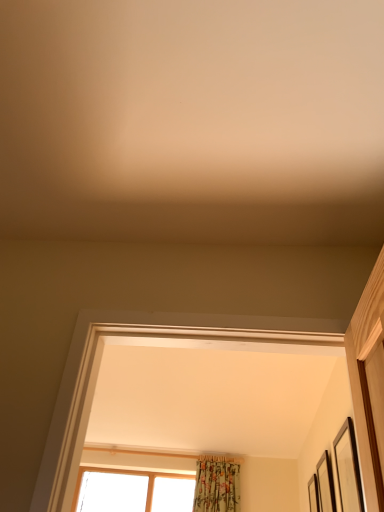
Question: In terms of width, does wooden picture frame at right, placed as the 2th picture frame when sorted from left to right, look wider or thinner when compared to black matte picture frame at right, which appears as the first picture frame when viewed from the top?

Choices:
 (A) thin
 (B) wide

Answer: (B)

Question: Is wooden picture frame at right, the second picture frame positioned from the bottom, situated inside black matte picture frame at right, which appears as the first picture frame when viewed from the top, or outside?

Choices:
 (A) outside
 (B) inside

Answer: (A)

Question: Considering the real-world distances, which object is farthest from the black matte picture frame at right, positioned as the 3th picture frame in bottom-to-top order?

Choices:
 (A) wooden picture frame at right, the third picture frame when ordered from front to back
 (B) wooden picture frame at right, the 2th picture frame when ordered from front to back

Answer: (A)

Question: Estimate the real-world distances between objects in this image. Which object is closer to the wooden picture frame at right, which ranks as the third picture frame in top-to-bottom order?

Choices:
 (A) black matte picture frame at right, which appears as the first picture frame when viewed from the top
 (B) wooden picture frame at right, placed as the 2th picture frame when sorted from left to right

Answer: (B)